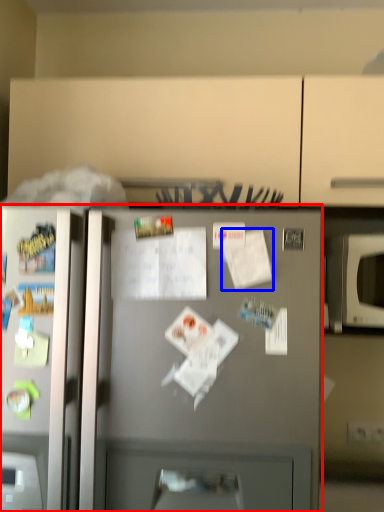
Question: Which of the following is the closest to the observer, refrigerator (highlighted by a red box) or paper (highlighted by a blue box)?

Choices:
 (A) refrigerator
 (B) paper

Answer: (A)